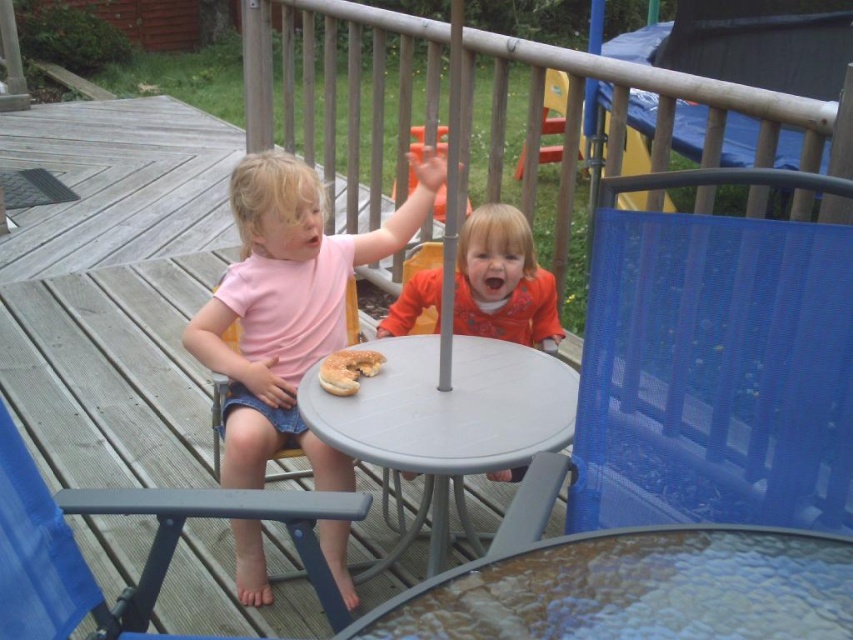
Question: Can you confirm if translucent glass table at center is smaller than gray plastic table at center?

Choices:
 (A) yes
 (B) no

Answer: (A)

Question: Which point is farther to the camera?

Choices:
 (A) (161, 563)
 (B) (521, 312)
 (C) (370, 371)

Answer: (B)

Question: Does translucent glass table at center appear on the right side of gray plastic table at center?

Choices:
 (A) no
 (B) yes

Answer: (B)

Question: Does gray plastic table at center come behind orange matte shirt at center?

Choices:
 (A) yes
 (B) no

Answer: (B)

Question: Which object is positioned closest to the golden glazed donut at center?

Choices:
 (A) orange matte shirt at center
 (B) blue plastic chair at lower left
 (C) pink matte shirt at center
 (D) gray plastic table at center

Answer: (D)

Question: Which object is the farthest from the orange matte shirt at center?

Choices:
 (A) translucent glass table at center
 (B) blue plastic chair at lower left
 (C) pink matte shirt at center

Answer: (A)